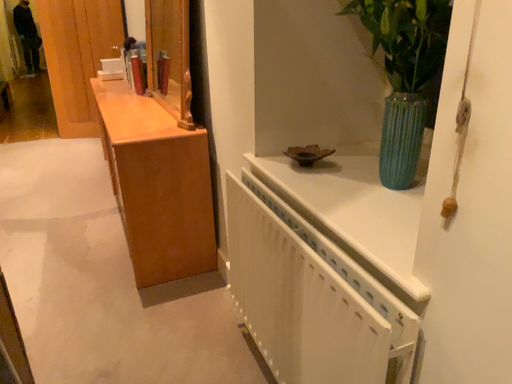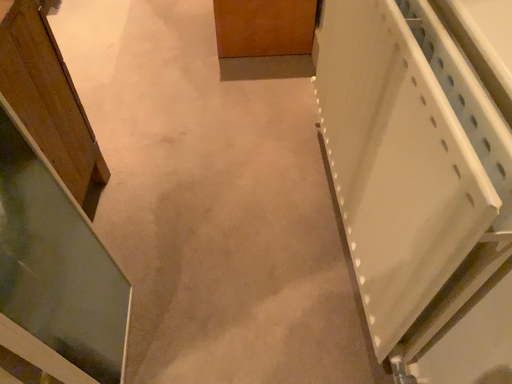
Question: How did the camera likely rotate when shooting the video?

Choices:
 (A) rotated downward
 (B) rotated upward

Answer: (A)